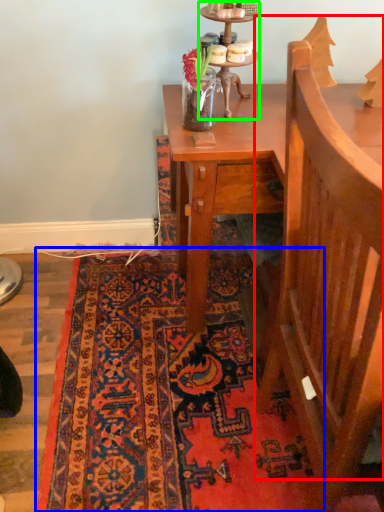
Question: Which object is positioned closest to armchair (highlighted by a red box)? Select from mat (highlighted by a blue box) and candle holder (highlighted by a green box).

Choices:
 (A) mat
 (B) candle holder

Answer: (A)